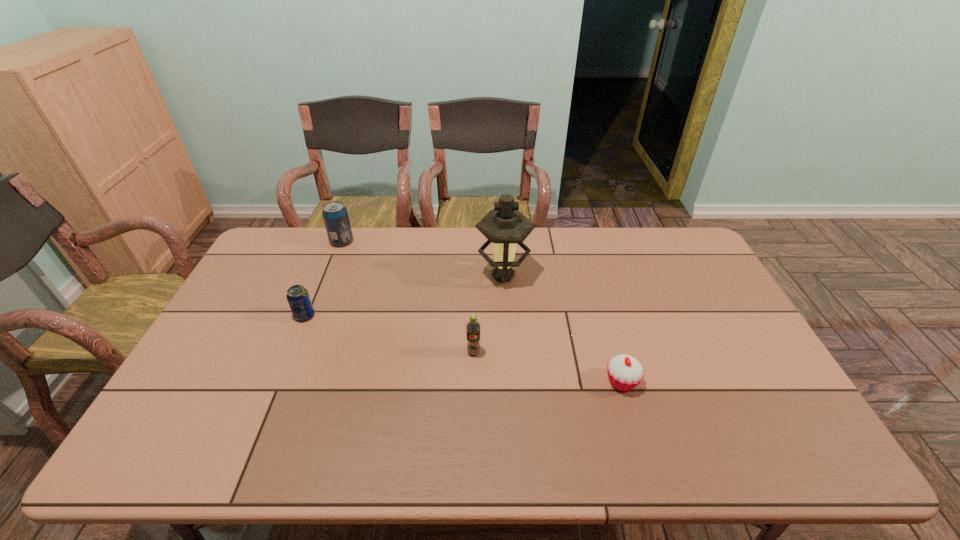
Where is `vacant space at the far left corner`? vacant space at the far left corner is located at coordinates (274, 237).

Locate an element on the screen. The image size is (960, 540). unoccupied area between the rightmost object and the farthest object is located at coordinates (482, 312).

The image size is (960, 540). I want to click on vacant space in between the farthest object and the shortest soda, so click(324, 279).

Locate an element on the screen. This screenshot has height=540, width=960. free spot between the fourth farthest object and the farthest soda is located at coordinates (408, 297).

I want to click on free space between the rightmost object and the rightmost soda, so click(x=547, y=367).

Locate an element on the screen. The height and width of the screenshot is (540, 960). free space between the nearest object and the second farthest soda is located at coordinates click(x=463, y=349).

The height and width of the screenshot is (540, 960). Identify the location of free spot between the farthest object and the third farthest object. (324, 279).

Where is `empty location between the farthest object and the rightmost soda`? This screenshot has width=960, height=540. empty location between the farthest object and the rightmost soda is located at coordinates (408, 297).

At what (x,y) coordinates should I click in order to perform the action: click on free space between the rightmost object and the oil lamp. Please return your answer as a coordinate pair (x, y). This screenshot has width=960, height=540. Looking at the image, I should click on 563,328.

At what (x,y) coordinates should I click in order to perform the action: click on vacant point located between the fourth nearest object and the rightmost object. Please return your answer as a coordinate pair (x, y). The width and height of the screenshot is (960, 540). Looking at the image, I should click on (563, 328).